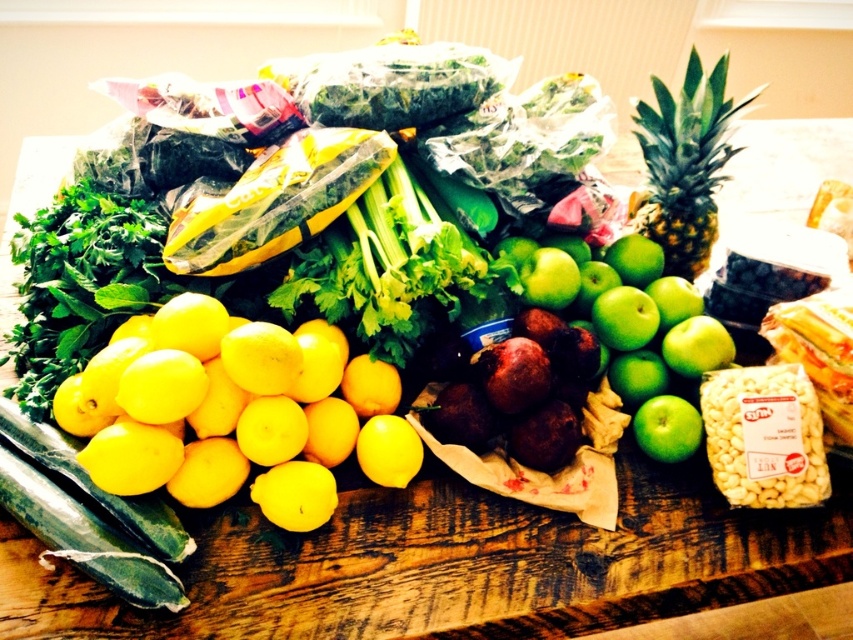
Is yellow matte lemons at left positioned in front of green matte pineapple at upper right?

That is True.

The image size is (853, 640). I want to click on yellow matte lemons at left, so click(231, 416).

Does point (279, 451) come farther from viewer compared to point (703, 93)?

No.

What are the coordinates of `yellow matte lemons at left` in the screenshot? It's located at (231, 416).

Does yellow matte lemons at left have a smaller size compared to green matte apples at center-right?

Indeed, yellow matte lemons at left has a smaller size compared to green matte apples at center-right.

You are a GUI agent. You are given a task and a screenshot of the screen. Output one action in this format:
    pyautogui.click(x=<x>, y=<y>)
    Task: Click on the yellow matte lemons at left
    The height and width of the screenshot is (640, 853).
    Given the screenshot: What is the action you would take?
    pyautogui.click(x=231, y=416)

Measure the distance between green matte pineapple at upper right and green matte apple at center-right.

A distance of 12.47 inches exists between green matte pineapple at upper right and green matte apple at center-right.

Does point (669, 115) come in front of point (670, 417)?

No, it is behind (670, 417).

Who is more distant from viewer, [695,132] or [648,412]?

Point [695,132]

Find the location of a particular element. green matte pineapple at upper right is located at coordinates point(685,163).